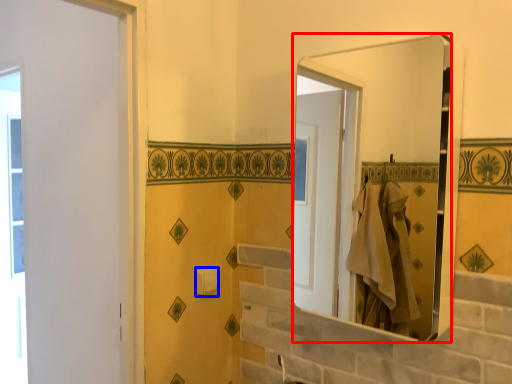
Question: Among these objects, which one is nearest to the camera, mirror (highlighted by a red box) or towel bar (highlighted by a blue box)?

Choices:
 (A) mirror
 (B) towel bar

Answer: (A)